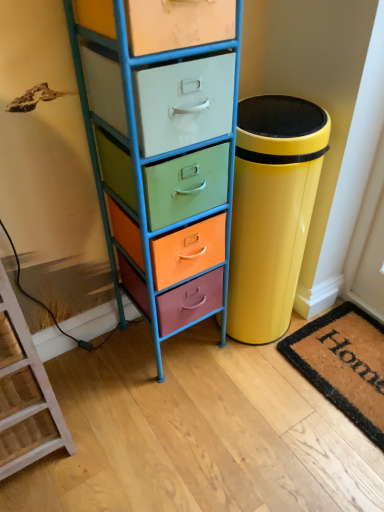
This screenshot has height=512, width=384. In order to click on free space in front of metallic multi-colored chest of drawers at left in this screenshot , I will do `click(170, 411)`.